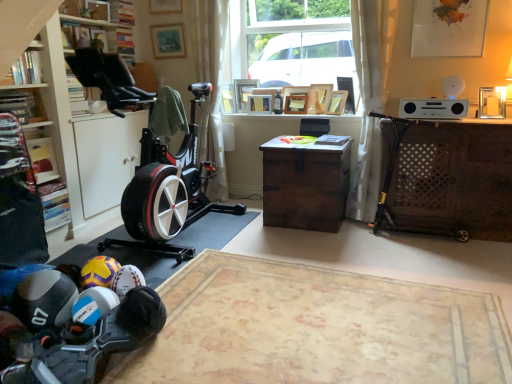
Question: Is point (40, 165) closer or farther from the camera than point (340, 187)?

Choices:
 (A) closer
 (B) farther

Answer: (A)

Question: From a real-world perspective, is wooden bookshelf at left, which is the third shelf in top-to-bottom order, physically located above or below brown wooden desk at center, the 1th desk in the left-to-right sequence?

Choices:
 (A) above
 (B) below

Answer: (A)

Question: Which is nearer to the white matte cabinet at left?

Choices:
 (A) wooden picture frame at upper center, which is the 5th picture frame in left-to-right order
 (B) white sheer curtain at center, marked as the second curtain in a right-to-left arrangement
 (C) wooden picture frame at center, the fifth picture frame when ordered from right to left
 (D) brown wooden desk at center, the 1th desk in the left-to-right sequence
 (E) wooden bookshelf at upper left, arranged as the 1th shelf when viewed from the top

Answer: (E)

Question: Based on their relative distances, which object is farther from the wooden picture frame at upper center, which appears as the 6th picture frame when viewed from the left?

Choices:
 (A) wooden picture frame at upper center, placed as the 2th picture frame when sorted from left to right
 (B) white sheer curtain at right, which ranks as the 2th curtain in left-to-right order
 (C) wooden bookshelf at upper left, the 3th shelf in the bottom-to-top sequence
 (D) white matte cabinet at left
 (E) white sheer curtain at center, marked as the second curtain in a right-to-left arrangement

Answer: (C)